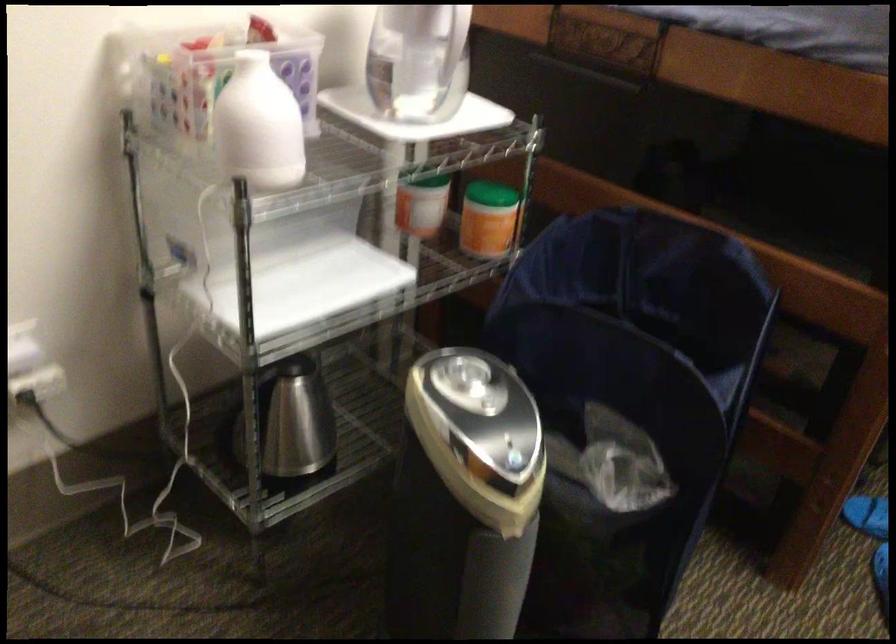
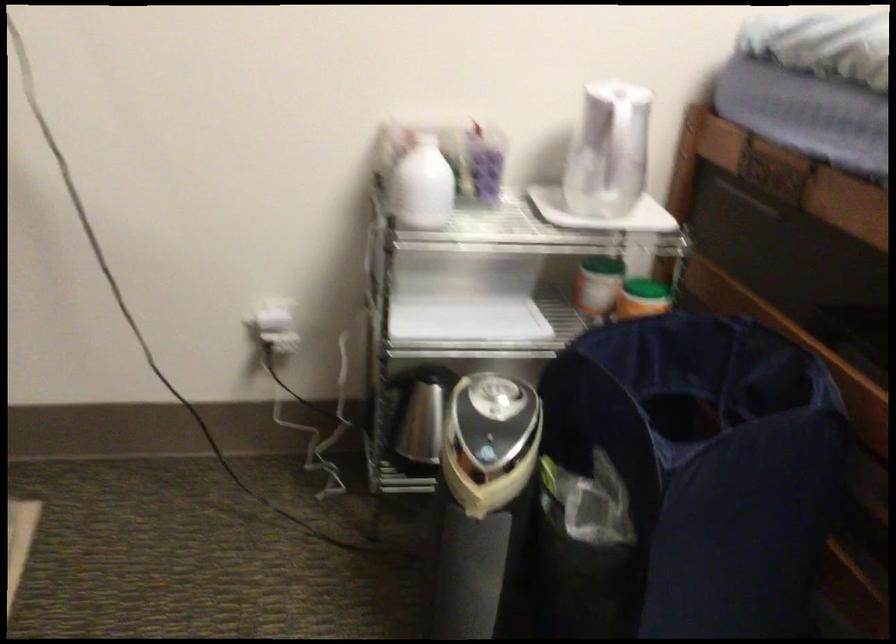
Find the pixel in the second image that matches [431,174] in the first image.

(602, 263)